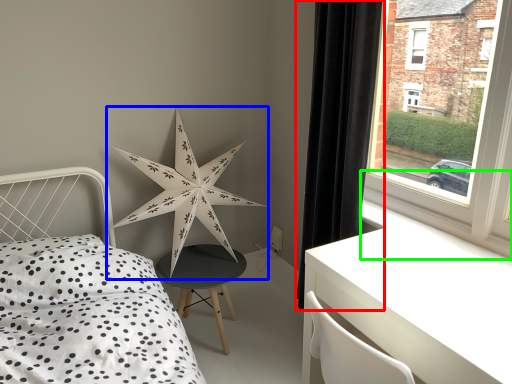
Question: Which is farther away from curtain (highlighted by a red box)? star (highlighted by a blue box) or window sill (highlighted by a green box)?

Choices:
 (A) star
 (B) window sill

Answer: (A)